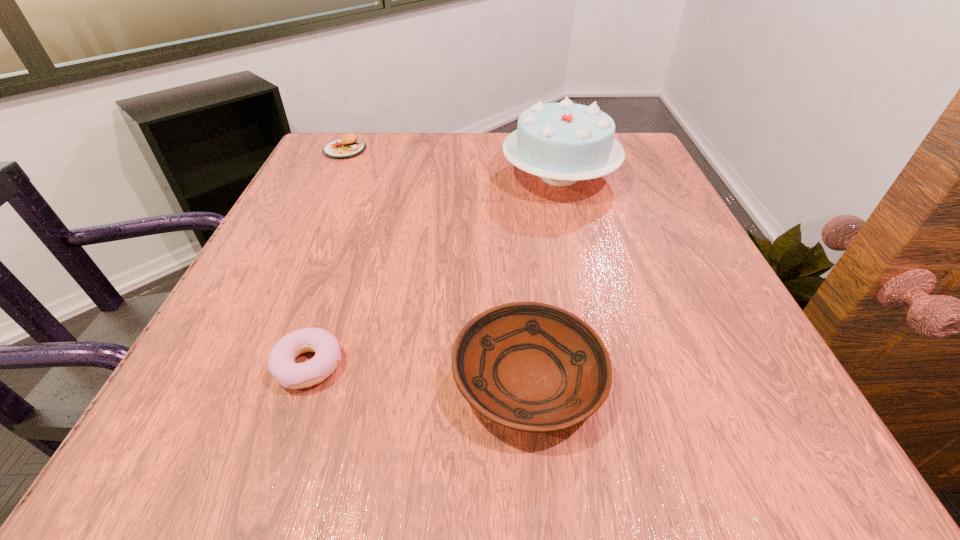
You are a GUI agent. You are given a task and a screenshot of the screen. Output one action in this format:
    pyautogui.click(x=<x>, y=<y>)
    Task: Click on the birthday cake
    The image size is (960, 540).
    Given the screenshot: What is the action you would take?
    pyautogui.click(x=562, y=143)

Where is `patty`? This screenshot has width=960, height=540. patty is located at coordinates (348, 146).

In order to click on plate in this screenshot , I will do `click(532, 367)`.

This screenshot has height=540, width=960. What are the coordinates of `the shortest object` in the screenshot? It's located at (281, 364).

Where is `free spot located on the front of the tallest object`? This screenshot has width=960, height=540. free spot located on the front of the tallest object is located at coordinates (584, 274).

Where is `free location located 0.330m on the front of the patty`? free location located 0.330m on the front of the patty is located at coordinates (300, 245).

Identify the location of vacant space situated on the left of the plate. The height and width of the screenshot is (540, 960). (246, 378).

The height and width of the screenshot is (540, 960). Identify the location of free space located 0.130m on the right of the shortest object. (433, 366).

I want to click on birthday cake that is at the far edge, so click(562, 143).

Locate an element on the screen. patty situated at the far edge is located at coordinates (348, 146).